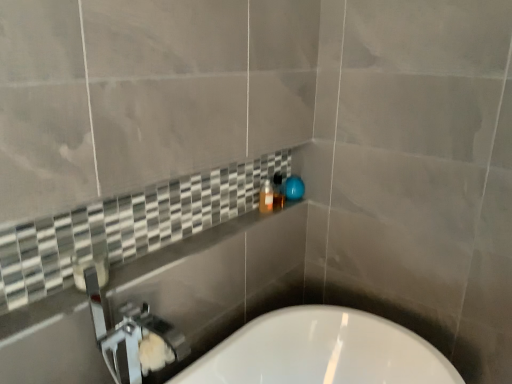
In order to click on matte black soap dispenser at center in this screenshot , I will do `click(278, 191)`.

In order to face white glossy bathtub at lower center, should I rotate leftwards or rightwards?

You should rotate right by 10.267 degrees.

The width and height of the screenshot is (512, 384). Identify the location of matte black soap dispenser at center. (278, 191).

Identify the location of bottle that is on the left side of matte black soap dispenser at center. (266, 197).

Is the surface of matte black soap dispenser at center in direct contact with translucent plastic bottle at upper center?

Yes, matte black soap dispenser at center is with translucent plastic bottle at upper center.

Which is more to the right, matte black soap dispenser at center or translucent plastic bottle at upper center?

From the viewer's perspective, matte black soap dispenser at center appears more on the right side.

Is translucent plastic bottle at upper center inside the boundaries of white glossy bathtub at lower center, or outside?

translucent plastic bottle at upper center exists outside the volume of white glossy bathtub at lower center.

Find the location of a particular element. bottle on the left side of white glossy bathtub at lower center is located at coordinates (266, 197).

From the image's perspective, which is below, translucent plastic bottle at upper center or white glossy bathtub at lower center?

white glossy bathtub at lower center appears lower in the image.

Considering the sizes of objects translucent plastic bottle at upper center and matte black soap dispenser at center in the image provided, who is wider, translucent plastic bottle at upper center or matte black soap dispenser at center?

With larger width is matte black soap dispenser at center.

How far apart are translucent plastic bottle at upper center and matte black soap dispenser at center?

A distance of 2.01 inches exists between translucent plastic bottle at upper center and matte black soap dispenser at center.

Who is more distant, translucent plastic bottle at upper center or matte black soap dispenser at center?

Positioned behind is matte black soap dispenser at center.

Who is bigger, translucent plastic bottle at upper center or matte black soap dispenser at center?

With larger size is translucent plastic bottle at upper center.

Is matte black soap dispenser at center directly adjacent to white glossy bathtub at lower center?

There is a gap between matte black soap dispenser at center and white glossy bathtub at lower center.

In terms of width, does matte black soap dispenser at center look wider or thinner when compared to white glossy bathtub at lower center?

Clearly, matte black soap dispenser at center has less width compared to white glossy bathtub at lower center.

From the image's perspective, relative to white glossy bathtub at lower center, is matte black soap dispenser at center above or below?

Based on their image positions, matte black soap dispenser at center is located above white glossy bathtub at lower center.

From the image's perspective, which one is positioned higher, white glossy bathtub at lower center or matte black soap dispenser at center?

matte black soap dispenser at center, from the image's perspective.

Is matte black soap dispenser at center inside white glossy bathtub at lower center?

No.

Considering the relative positions of white glossy bathtub at lower center and matte black soap dispenser at center in the image provided, is white glossy bathtub at lower center to the right of matte black soap dispenser at center from the viewer's perspective?

Indeed, white glossy bathtub at lower center is positioned on the right side of matte black soap dispenser at center.

Is white glossy bathtub at lower center not near matte black soap dispenser at center?

white glossy bathtub at lower center is near matte black soap dispenser at center, not far away.

Choose the correct answer: Is white glossy bathtub at lower center inside translucent plastic bottle at upper center or outside it?

white glossy bathtub at lower center is located beyond the bounds of translucent plastic bottle at upper center.

Is white glossy bathtub at lower center far away from translucent plastic bottle at upper center?

They are positioned close to each other.

Considering the sizes of objects white glossy bathtub at lower center and translucent plastic bottle at upper center in the image provided, who is bigger, white glossy bathtub at lower center or translucent plastic bottle at upper center?

With larger size is white glossy bathtub at lower center.

Where is `bottle behind the white glossy bathtub at lower center`? The width and height of the screenshot is (512, 384). bottle behind the white glossy bathtub at lower center is located at coordinates (266, 197).

In order to click on toiletry above the translucent plastic bottle at upper center (from a real-world perspective) in this screenshot , I will do `click(278, 191)`.

Locate an element on the screen. The height and width of the screenshot is (384, 512). bottle above the white glossy bathtub at lower center (from the image's perspective) is located at coordinates (266, 197).

Which object lies further to the anchor point matte black soap dispenser at center, translucent plastic bottle at upper center or white glossy bathtub at lower center?

white glossy bathtub at lower center is positioned further to the anchor matte black soap dispenser at center.

When comparing their distances from translucent plastic bottle at upper center, does white glossy bathtub at lower center or matte black soap dispenser at center seem closer?

matte black soap dispenser at center is positioned closer to the anchor translucent plastic bottle at upper center.

When comparing their distances from translucent plastic bottle at upper center, does matte black soap dispenser at center or white glossy bathtub at lower center seem closer?

The object closer to translucent plastic bottle at upper center is matte black soap dispenser at center.

Based on their spatial positions, is translucent plastic bottle at upper center or matte black soap dispenser at center further from white glossy bathtub at lower center?

matte black soap dispenser at center lies further to white glossy bathtub at lower center than the other object.

Considering their positions, is matte black soap dispenser at center positioned further to white glossy bathtub at lower center than translucent plastic bottle at upper center?

matte black soap dispenser at center.

Looking at the image, which one is located further to matte black soap dispenser at center, white glossy bathtub at lower center or translucent plastic bottle at upper center?

white glossy bathtub at lower center.

Where is `bottle between white glossy bathtub at lower center and matte black soap dispenser at center in the front-back direction`? This screenshot has width=512, height=384. bottle between white glossy bathtub at lower center and matte black soap dispenser at center in the front-back direction is located at coordinates (266, 197).